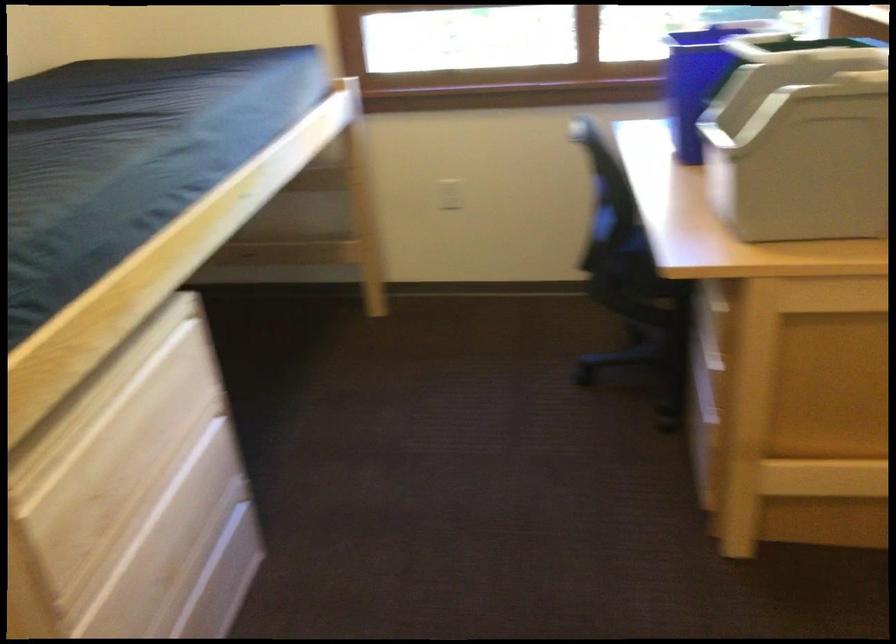
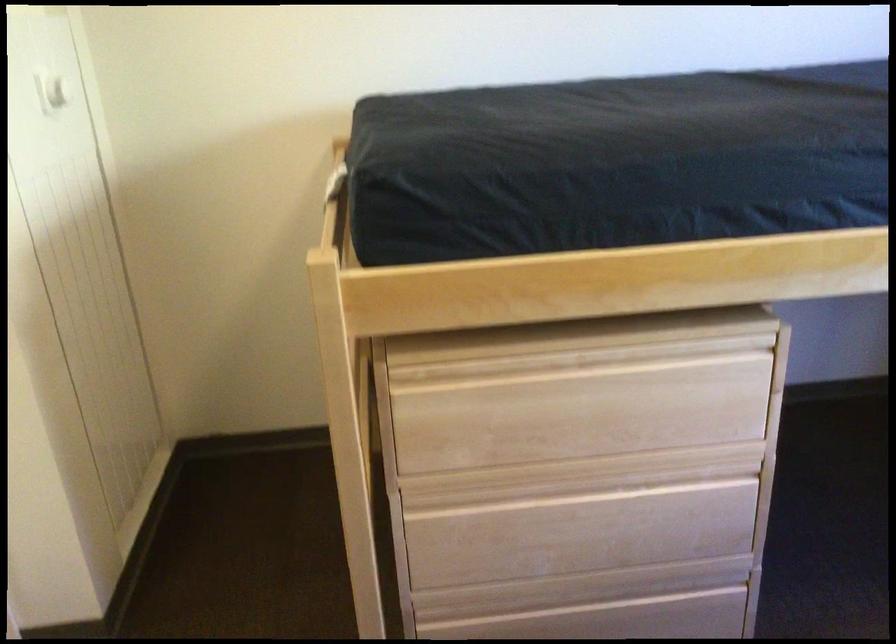
Where in the second image is the point corresponding to (x=149, y=383) from the first image?

(642, 377)